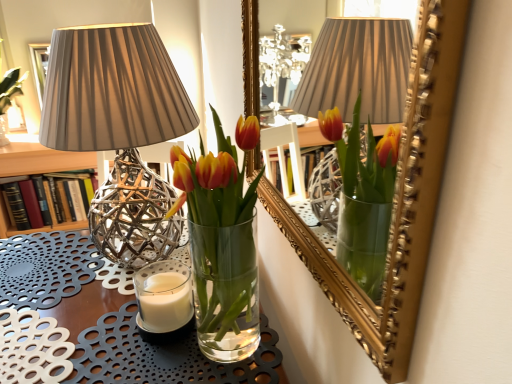
In order to click on free spot to the left of translucent glass vase at center in this screenshot , I will do `click(116, 348)`.